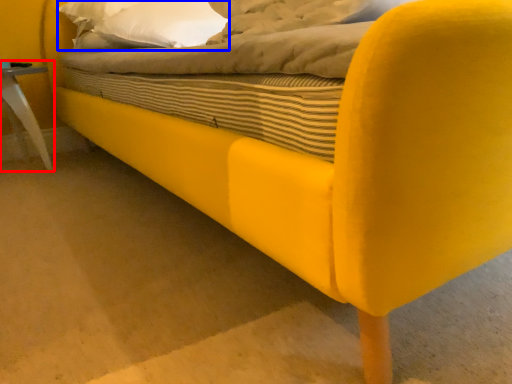
Question: Which point is closer to the camera, furniture (highlighted by a red box) or pillow (highlighted by a blue box)?

Choices:
 (A) furniture
 (B) pillow

Answer: (B)